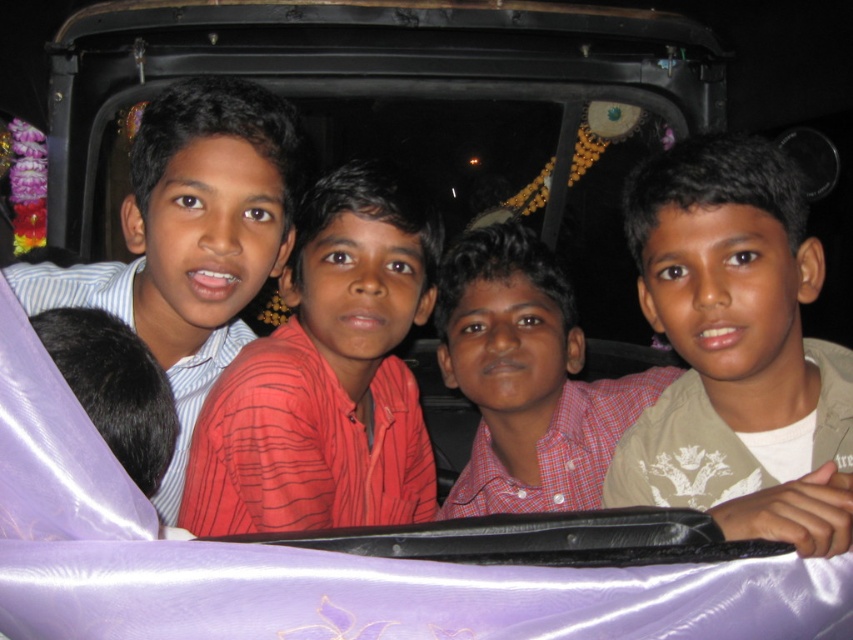
Question: Which point appears farthest from the camera in this image?

Choices:
 (A) (161, 422)
 (B) (496, 300)
 (C) (137, 141)
 (D) (734, 396)

Answer: (B)

Question: Can you confirm if beige textured shirt at right is positioned to the right of red checkered shirt at center?

Choices:
 (A) yes
 (B) no

Answer: (A)

Question: Estimate the real-world distances between objects in this image. Which object is closer to the matte white shirt at left?

Choices:
 (A) black fur at left
 (B) red checkered shirt at center
 (C) beige textured shirt at right

Answer: (A)

Question: Is beige textured shirt at right below black fur at left?

Choices:
 (A) yes
 (B) no

Answer: (B)

Question: Which point appears farthest from the camera in this image?

Choices:
 (A) (611, 387)
 (B) (99, 429)
 (C) (790, 342)

Answer: (A)

Question: Is matte white shirt at left closer to the viewer compared to red checkered shirt at center?

Choices:
 (A) no
 (B) yes

Answer: (B)